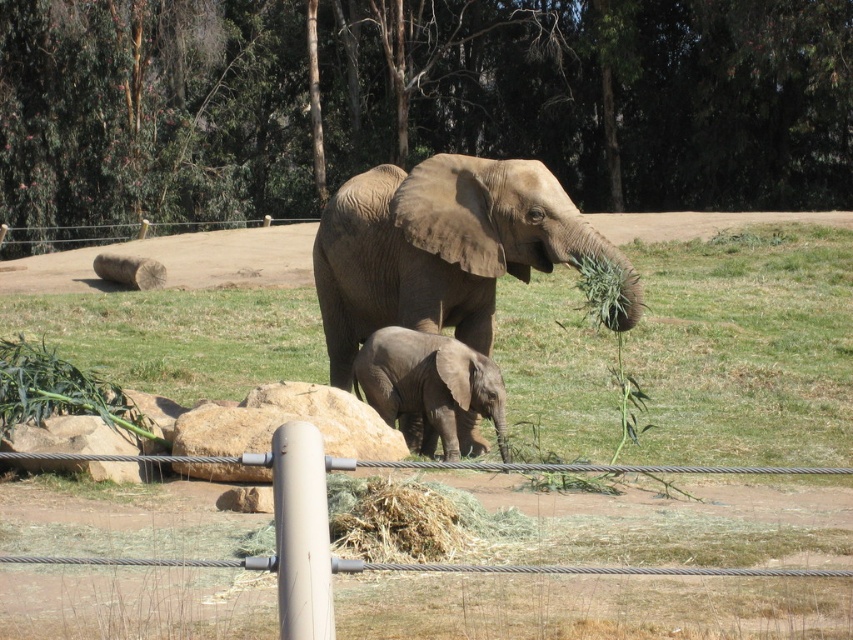
Question: Is green leafy tree at upper center to the right of green grassy at center from the viewer's perspective?

Choices:
 (A) no
 (B) yes

Answer: (B)

Question: Can you confirm if gray textured elephant at center is thinner than gray matte elephant at center?

Choices:
 (A) yes
 (B) no

Answer: (A)

Question: Which of these objects is positioned closest to the green leafy tree at upper center?

Choices:
 (A) gray textured elephant at center
 (B) gray matte elephant at center

Answer: (B)

Question: Which object appears closest to the camera in this image?

Choices:
 (A) green grassy at center
 (B) green leafy tree at upper center
 (C) gray textured elephant at center
 (D) gray matte elephant at center

Answer: (A)

Question: Does green leafy tree at upper center appear under gray textured elephant at center?

Choices:
 (A) yes
 (B) no

Answer: (B)

Question: Which point is farther to the camera?

Choices:
 (A) gray matte elephant at center
 (B) gray textured elephant at center

Answer: (B)